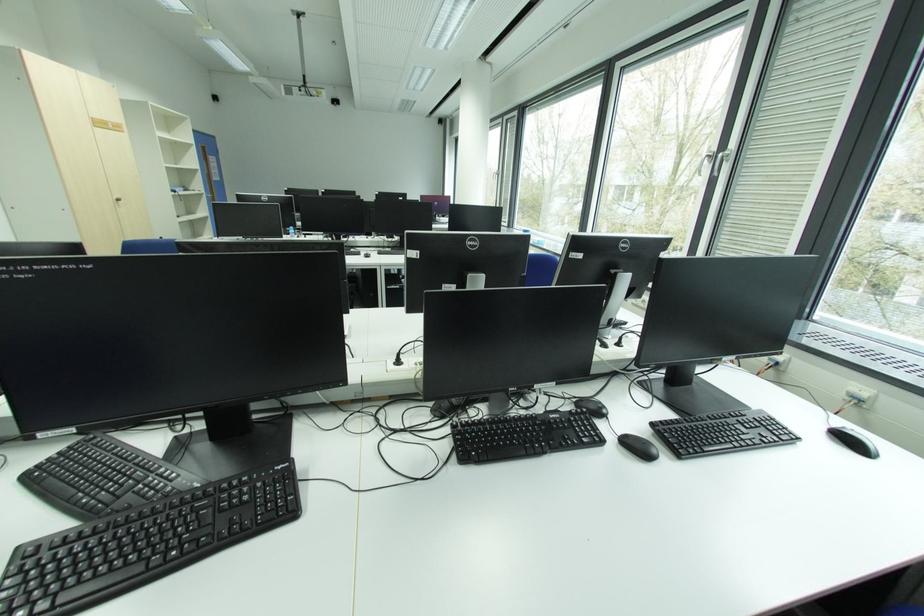
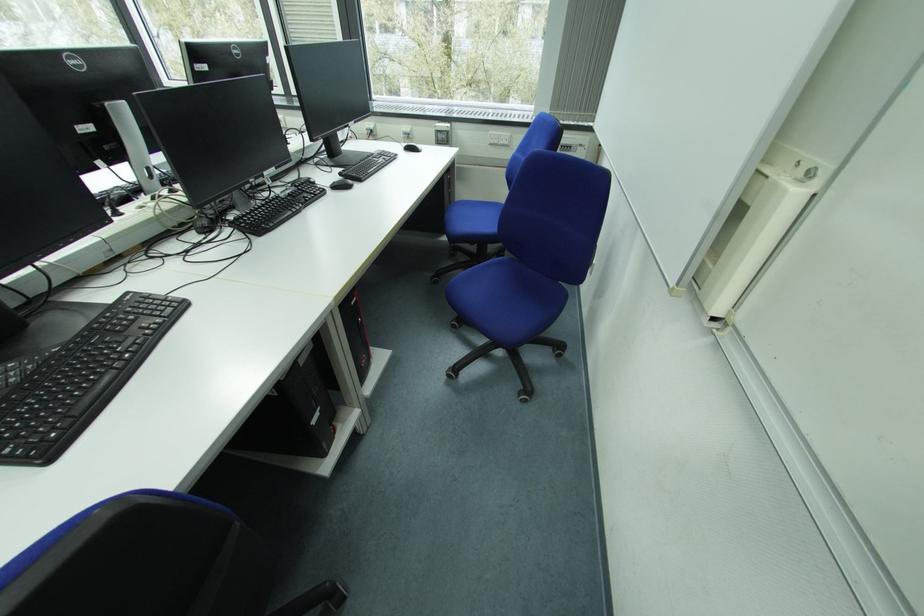
Find the pixel in the second image that matches the point at 853,400 in the first image.

(409, 137)